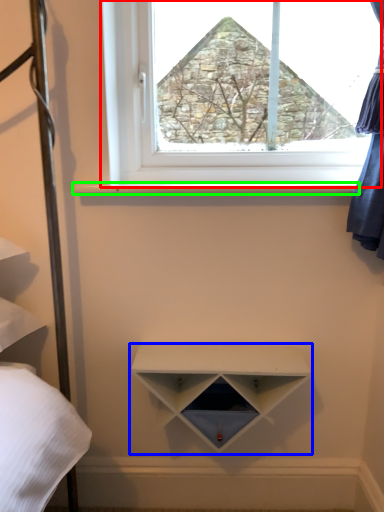
Question: Based on their relative distances, which object is nearer to window (highlighted by a red box)? Choose from shelf (highlighted by a blue box) and window sill (highlighted by a green box).

Choices:
 (A) shelf
 (B) window sill

Answer: (B)